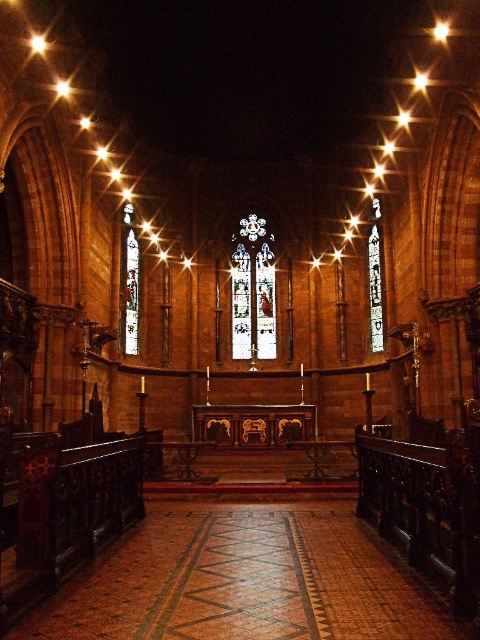
Is stained glass at center wider than clear glass stained glass at left?

Yes.

Between stained glass at center and clear glass stained glass at left, which one is positioned higher?

stained glass at center is above.

Between point (250, 228) and point (131, 260), which one is positioned behind?

Positioned behind is point (250, 228).

Find the location of a particular element. stained glass at center is located at coordinates (252, 291).

From the picture: Which is more to the left, clear glass stained glass at left or transparent stained glass at center?

clear glass stained glass at left

Can you confirm if clear glass stained glass at left is positioned below transparent stained glass at center?

Yes.

Is point (128, 248) less distant than point (376, 323)?

No, it is behind (376, 323).

The width and height of the screenshot is (480, 640). In order to click on clear glass stained glass at left in this screenshot , I will do `click(130, 282)`.

From the picture: Which is more to the left, stained glass at center or transparent stained glass at center?

stained glass at center

Is stained glass at center wider than transparent stained glass at center?

Yes, stained glass at center is wider than transparent stained glass at center.

Which is in front, point (252, 348) or point (370, 333)?

Point (370, 333)

Where is `stained glass at center`? The image size is (480, 640). stained glass at center is located at coordinates (252, 291).